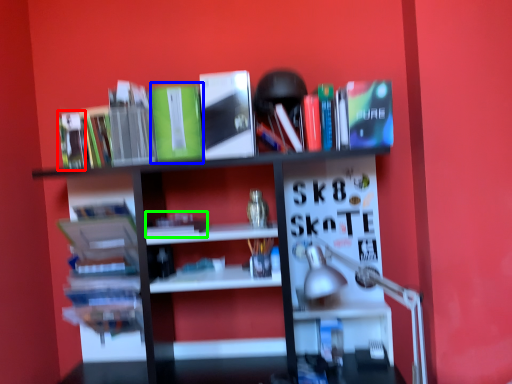
Question: Which object is the closest to the book (highlighted by a red box)? Choose among these: paperback book (highlighted by a blue box) or book (highlighted by a green box).

Choices:
 (A) paperback book
 (B) book

Answer: (A)